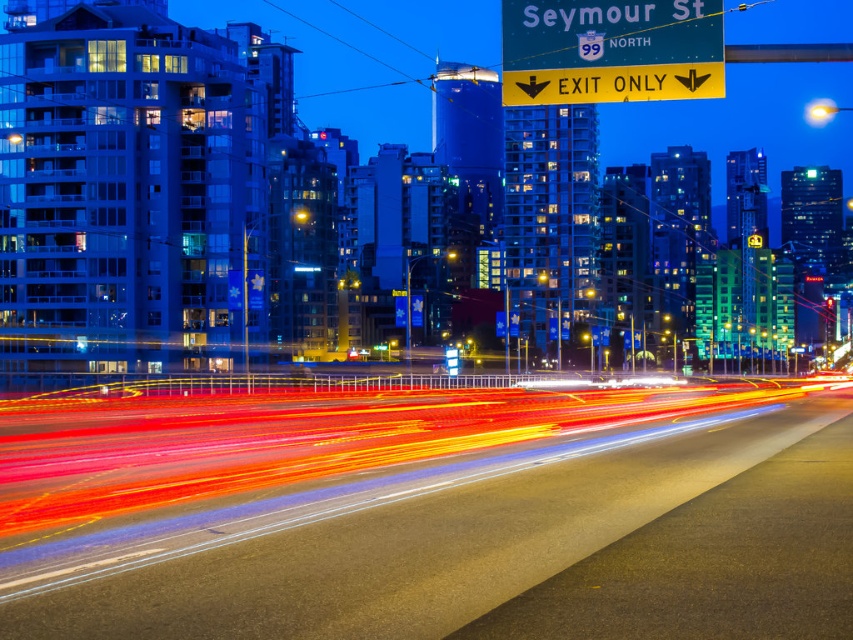
Question: Is metallic asphalt highway at center thinner than yellow plastic sign at upper center?

Choices:
 (A) no
 (B) yes

Answer: (A)

Question: Which point appears closest to the camera in this image?

Choices:
 (A) (683, 48)
 (B) (664, 458)

Answer: (A)

Question: Among these points, which one is farthest from the camera?

Choices:
 (A) (520, 484)
 (B) (583, 72)

Answer: (B)

Question: Can you confirm if metallic asphalt highway at center is smaller than yellow plastic sign at upper center?

Choices:
 (A) yes
 (B) no

Answer: (B)

Question: Can you confirm if metallic asphalt highway at center is positioned to the left of yellow plastic sign at upper center?

Choices:
 (A) yes
 (B) no

Answer: (B)

Question: Which point is farther to the camera?

Choices:
 (A) (457, 577)
 (B) (598, 19)

Answer: (B)